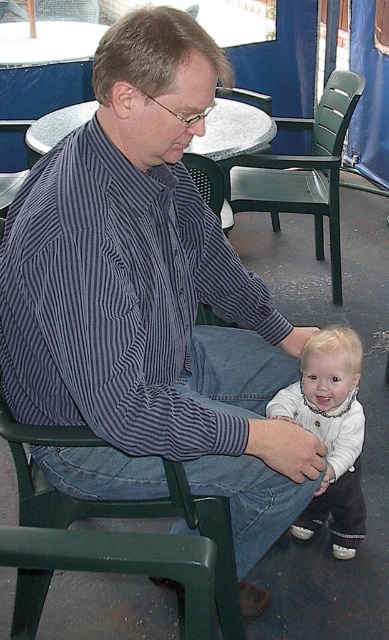
Is green plastic chair at lower left smaller than green plastic chair at center?

Indeed, green plastic chair at lower left has a smaller size compared to green plastic chair at center.

Between point (42, 579) and point (345, 74), which one is positioned behind?

The point (345, 74) is behind.

Locate an element on the screen. This screenshot has height=640, width=389. green plastic chair at lower left is located at coordinates (124, 506).

Can you confirm if green plastic chair at lower left is positioned to the left of white soft fabric baby at lower center?

Correct, you'll find green plastic chair at lower left to the left of white soft fabric baby at lower center.

This screenshot has width=389, height=640. In order to click on green plastic chair at lower left in this screenshot , I will do `click(124, 506)`.

This screenshot has height=640, width=389. Find the location of `green plastic chair at lower left`. green plastic chair at lower left is located at coordinates (124, 506).

Does white soft fabric baby at lower center appear on the right side of green plastic chair at center?

Incorrect, white soft fabric baby at lower center is not on the right side of green plastic chair at center.

Is white soft fabric baby at lower center bigger than green plastic chair at center?

Incorrect, white soft fabric baby at lower center is not larger than green plastic chair at center.

This screenshot has height=640, width=389. In order to click on white soft fabric baby at lower center in this screenshot , I will do `click(331, 433)`.

Locate an element on the screen. This screenshot has height=640, width=389. white soft fabric baby at lower center is located at coordinates (331, 433).